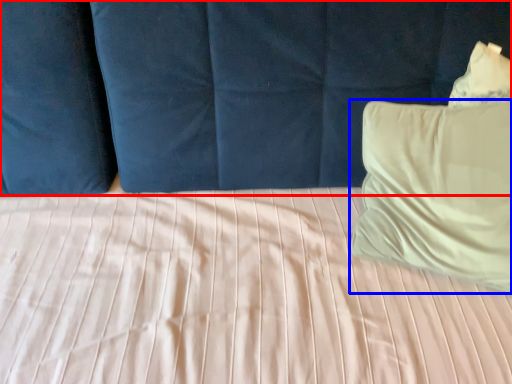
Question: Which object is further to the camera taking this photo, curtain (highlighted by a red box) or pillow (highlighted by a blue box)?

Choices:
 (A) curtain
 (B) pillow

Answer: (B)